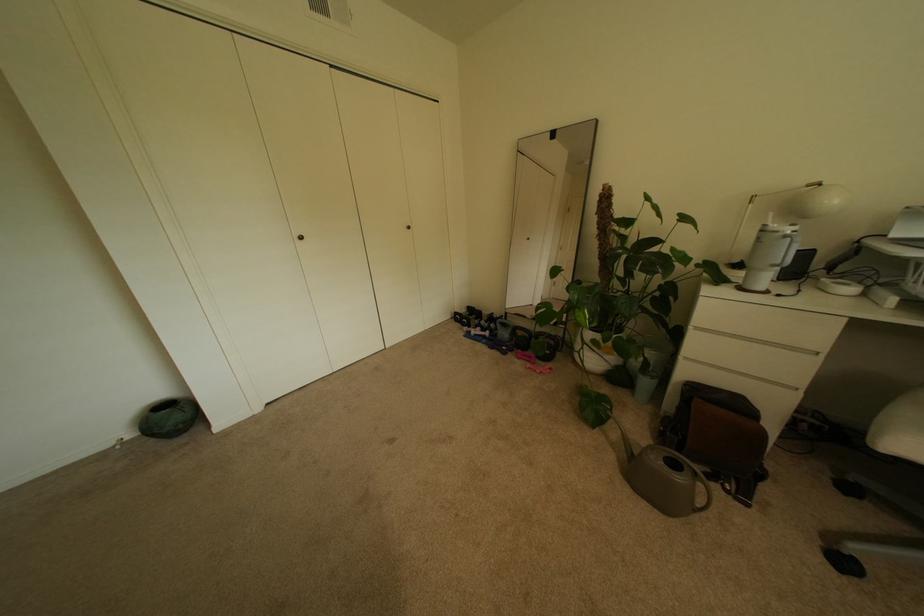
What are the coordinates of `brown bag` in the screenshot? It's located at (718, 430).